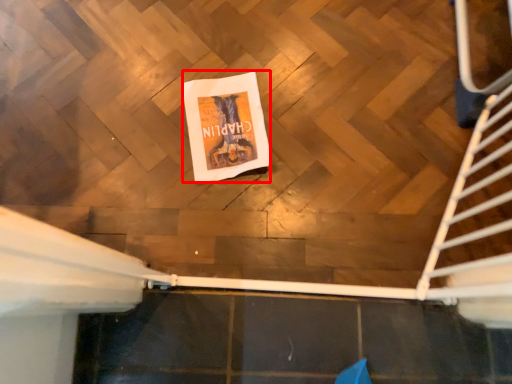
Question: From the image's perspective, what is the correct spatial relationship of flyer (annotated by the red box) in relation to stairs?

Choices:
 (A) above
 (B) below

Answer: (A)